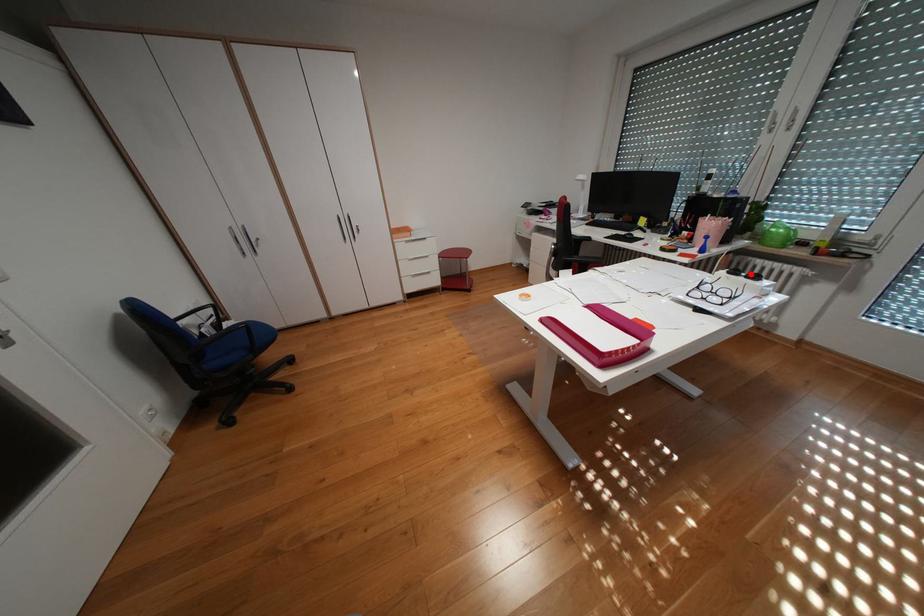
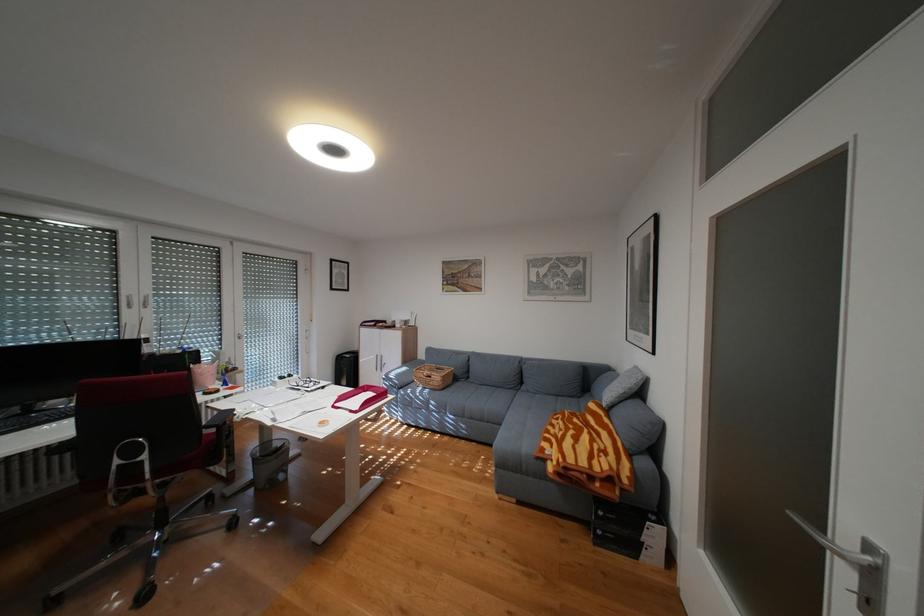
The point at the highlighted location is marked in the first image. Where is the corresponding point in the second image?

(297, 377)